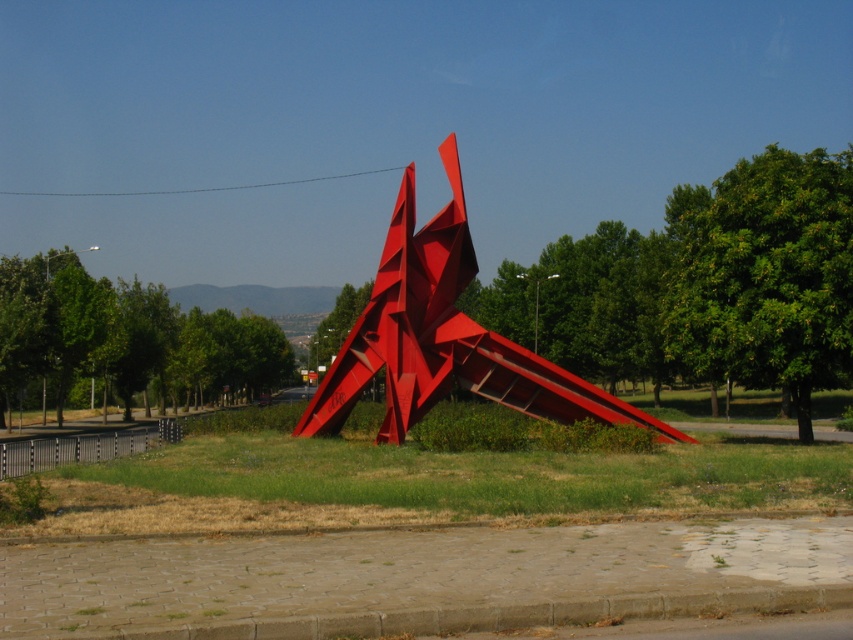
Question: Does green grass at center have a smaller size compared to green leafy tree at center?

Choices:
 (A) no
 (B) yes

Answer: (B)

Question: Does green grass at center have a smaller size compared to green leafy tree at left?

Choices:
 (A) no
 (B) yes

Answer: (B)

Question: Observing the image, what is the correct spatial positioning of glossy metal sculpture at center in reference to green leafy tree at left?

Choices:
 (A) below
 (B) above

Answer: (B)

Question: Which point is farther to the camera?

Choices:
 (A) (686, 333)
 (B) (476, 464)
 (C) (579, 419)
 (D) (242, 330)

Answer: (D)

Question: Which of the following is the closest to the observer?

Choices:
 (A) green leafy tree at left
 (B) green grass at center
 (C) glossy metal sculpture at center
 (D) green leafy tree at center

Answer: (B)

Question: Which is nearer to the green leafy tree at center?

Choices:
 (A) green grass at center
 (B) glossy metal sculpture at center

Answer: (A)